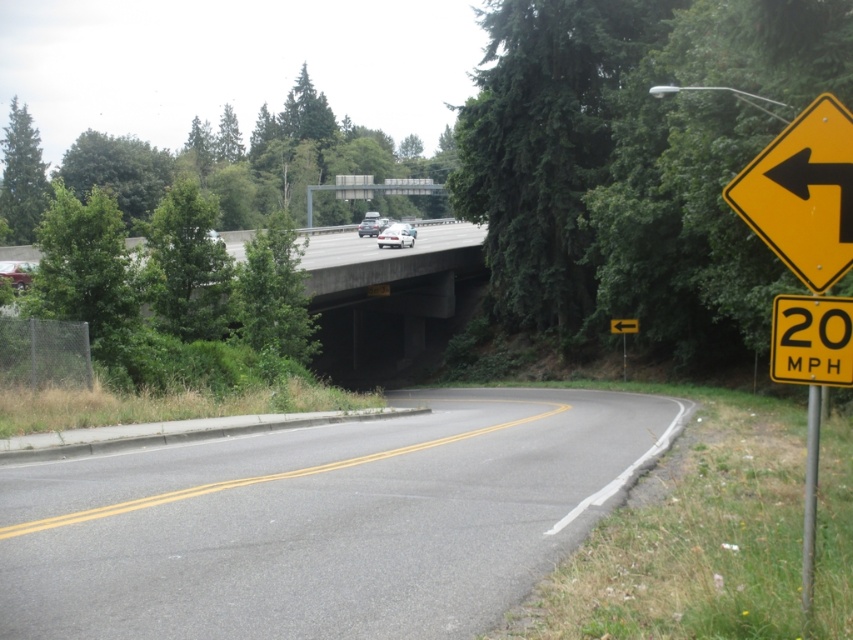
Between gray asphalt road at center and metallic pole at right, which one has more height?

metallic pole at right

Is gray asphalt road at center wider than metallic pole at right?

Yes.

You are a GUI agent. You are given a task and a screenshot of the screen. Output one action in this format:
    pyautogui.click(x=<x>, y=<y>)
    Task: Click on the gray asphalt road at center
    
    Given the screenshot: What is the action you would take?
    pyautogui.click(x=322, y=520)

Where is `gray asphalt road at center`? gray asphalt road at center is located at coordinates (322, 520).

Does yellow metallic speed limit sign at right appear over white glossy sedan at upper center?

Incorrect, yellow metallic speed limit sign at right is not positioned above white glossy sedan at upper center.

Does yellow metallic speed limit sign at right have a smaller size compared to white glossy sedan at upper center?

Indeed, yellow metallic speed limit sign at right has a smaller size compared to white glossy sedan at upper center.

This screenshot has width=853, height=640. I want to click on yellow metallic speed limit sign at right, so click(811, 339).

From the picture: Can you confirm if yellow metallic speed limit sign at right is positioned below yellow metal signpost at right?

No.

Who is more forward, [846,305] or [625,378]?

Positioned in front is point [846,305].

Identify the location of yellow metallic speed limit sign at right. Image resolution: width=853 pixels, height=640 pixels. (811, 339).